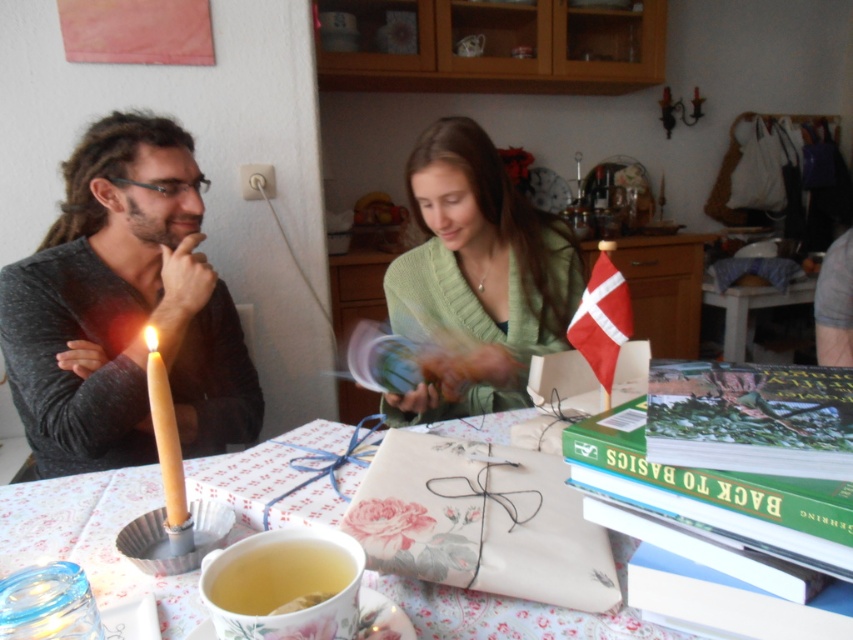
How much distance is there between hardcover book at right and green matte sweater at center?

hardcover book at right is 82.64 centimeters away from green matte sweater at center.

Does point (749, 518) lie in front of point (532, 269)?

Yes, it is in front of point (532, 269).

Does point (787, 406) lie behind point (583, 282)?

No, it is in front of (583, 282).

I want to click on hardcover book at right, so click(732, 449).

Is hardcover book at right taller than yellow wax candle at left?

No, hardcover book at right is not taller than yellow wax candle at left.

Does hardcover book at right appear over yellow wax candle at left?

Yes.

Between point (705, 368) and point (173, 508), which one is positioned behind?

The point (705, 368) is behind.

Image resolution: width=853 pixels, height=640 pixels. Find the location of `hardcover book at right`. hardcover book at right is located at coordinates (732, 449).

Between point (47, 285) and point (235, 374), which one is positioned in front?

Point (47, 285) is in front.

Between gray matte shirt at left and matte black shirt at left, which one has less height?

matte black shirt at left is shorter.

Consider the image. Measure the distance between gray matte shirt at left and camera.

The distance of gray matte shirt at left from camera is 1.12 meters.

What are the coordinates of `gray matte shirt at left` in the screenshot? It's located at (125, 308).